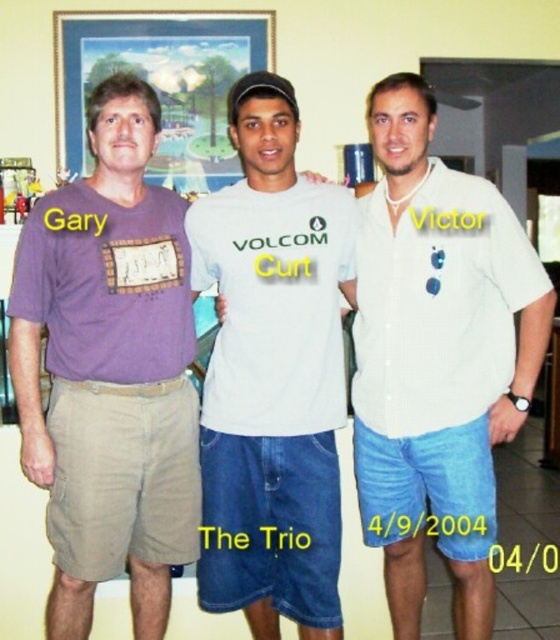
Question: Which point appears closest to the camera in this image?

Choices:
 (A) (478, 452)
 (B) (16, 292)

Answer: (B)

Question: Does white cotton shirt at center appear on the left side of white matte t-shirt at center?

Choices:
 (A) no
 (B) yes

Answer: (A)

Question: Is white cotton shirt at center to the right of white textured shirt at center from the viewer's perspective?

Choices:
 (A) yes
 (B) no

Answer: (A)

Question: Which point is farther to the camera?

Choices:
 (A) white cotton shirt at center
 (B) white textured shirt at center
 (C) wooden frame at upper center

Answer: (C)

Question: Among these points, which one is nearest to the camera?

Choices:
 (A) [x=518, y=387]
 (B) [x=122, y=17]

Answer: (A)

Question: Considering the relative positions of white cotton shirt at center and white matte t-shirt at center in the image provided, where is white cotton shirt at center located with respect to white matte t-shirt at center?

Choices:
 (A) below
 (B) above

Answer: (A)